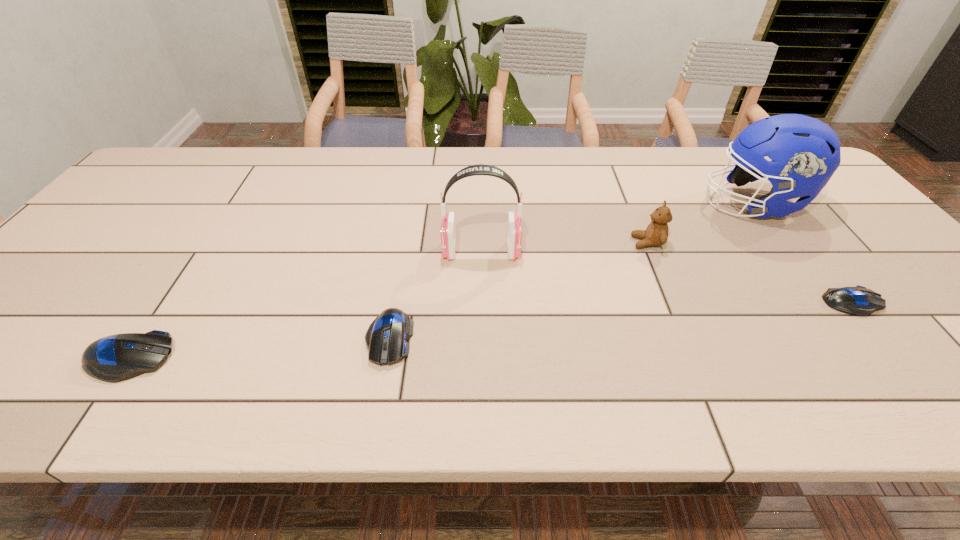
To achieve even spacing by inserting another mouse_(computer_equipment) among them, please point to a vacant spot for this new mouse_(computer_equipment). Please provide its 2D coordinates. Your answer should be formatted as a tuple, i.e. [(x, y)], where the tuple contains the x and y coordinates of a point satisfying the conditions above.

[(629, 320)]